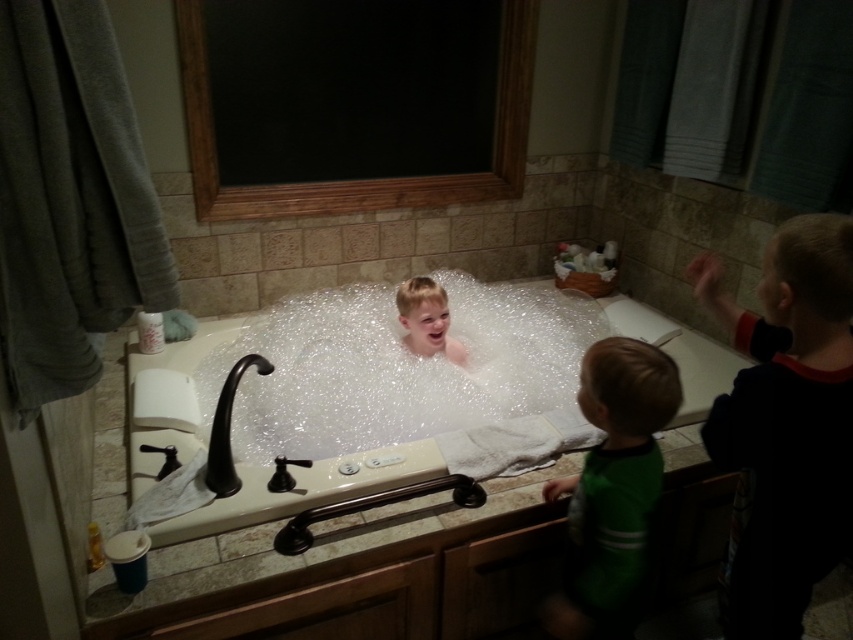
Does clear bubble foam at center appear on the left side of black cotton shirt at upper right?

Yes, clear bubble foam at center is to the left of black cotton shirt at upper right.

Is clear bubble foam at center above black cotton shirt at upper right?

Indeed, clear bubble foam at center is positioned over black cotton shirt at upper right.

Where is `clear bubble foam at center`? clear bubble foam at center is located at coordinates (401, 369).

Between point (424, 358) and point (846, 292), which one is positioned in front?

Point (846, 292)

Can you confirm if clear plastic bubble bath at center is shorter than black cotton shirt at upper right?

Yes.

Image resolution: width=853 pixels, height=640 pixels. What do you see at coordinates (383, 397) in the screenshot?
I see `clear plastic bubble bath at center` at bounding box center [383, 397].

At what (x,y) coordinates should I click in order to perform the action: click on clear plastic bubble bath at center. Please return your answer as a coordinate pair (x, y). This screenshot has height=640, width=853. Looking at the image, I should click on (383, 397).

Between point (579, 628) and point (418, 337), which one is positioned behind?

The point (418, 337) is behind.

Which is behind, point (605, 426) or point (454, 342)?

The point (454, 342) is more distant.

Locate an element on the screen. green cotton shirt at lower right is located at coordinates (612, 488).